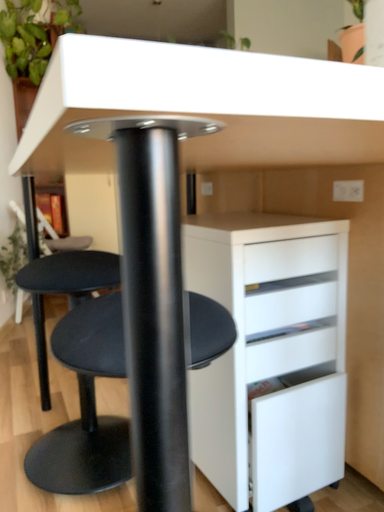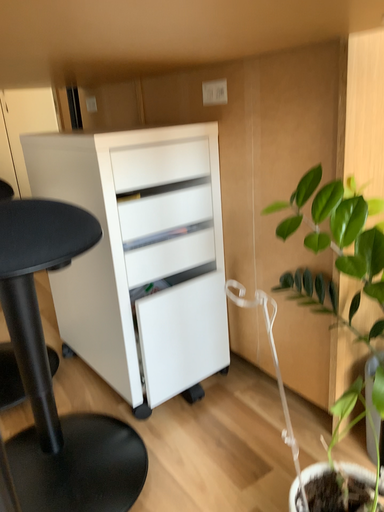
Question: Which way did the camera rotate in the video?

Choices:
 (A) rotated downward
 (B) rotated upward

Answer: (A)